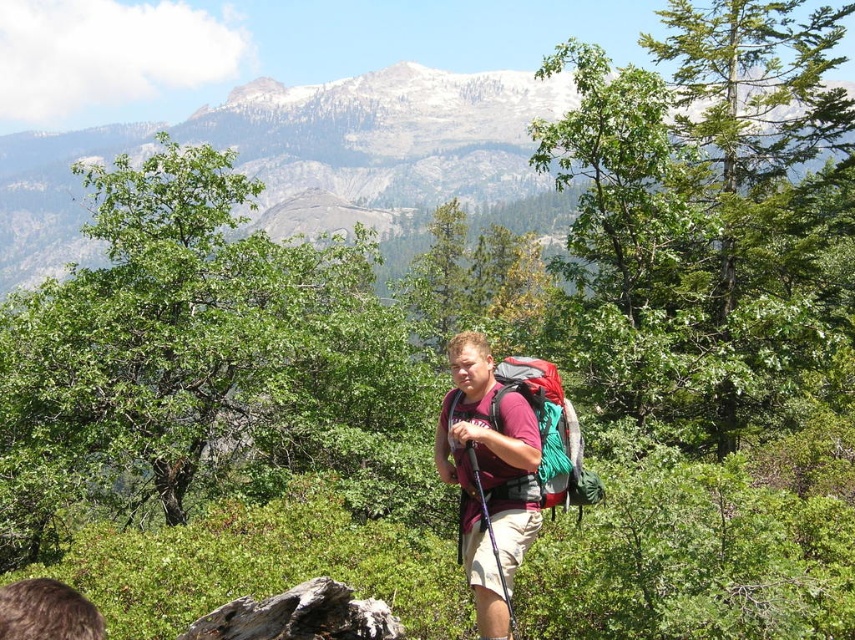
Which is above, snowy granite mountain at upper center or matte red backpack at center?

snowy granite mountain at upper center is higher up.

The height and width of the screenshot is (640, 855). Describe the element at coordinates (302, 154) in the screenshot. I see `snowy granite mountain at upper center` at that location.

This screenshot has height=640, width=855. What are the coordinates of `snowy granite mountain at upper center` in the screenshot? It's located at (302, 154).

Can you confirm if snowy granite mountain at upper center is bigger than matte red shirt at center?

Indeed, snowy granite mountain at upper center has a larger size compared to matte red shirt at center.

Who is lower down, snowy granite mountain at upper center or matte red shirt at center?

matte red shirt at center

Image resolution: width=855 pixels, height=640 pixels. Describe the element at coordinates (302, 154) in the screenshot. I see `snowy granite mountain at upper center` at that location.

Find the location of a particular element. The width and height of the screenshot is (855, 640). snowy granite mountain at upper center is located at coordinates (302, 154).

Does matte red shirt at center have a smaller size compared to matte red backpack at center?

Indeed, matte red shirt at center has a smaller size compared to matte red backpack at center.

Is matte red shirt at center thinner than matte red backpack at center?

Correct, matte red shirt at center's width is less than matte red backpack at center's.

You are a GUI agent. You are given a task and a screenshot of the screen. Output one action in this format:
    pyautogui.click(x=<x>, y=<y>)
    Task: Click on the matte red shirt at center
    The image size is (855, 640).
    Given the screenshot: What is the action you would take?
    pyautogui.click(x=482, y=465)